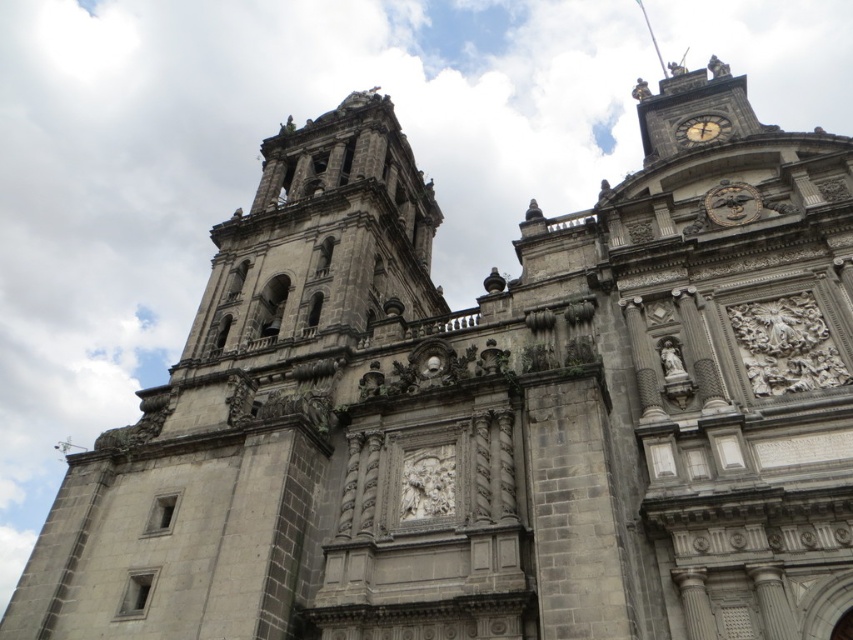
Question: Is gold metallic clock at upper center to the left of golden metallic clock at upper right from the viewer's perspective?

Choices:
 (A) yes
 (B) no

Answer: (A)

Question: Which point is closer to the camera?

Choices:
 (A) golden metallic clock at upper right
 (B) gold metallic clock at upper center

Answer: (B)

Question: Which of the following is the closest to the observer?

Choices:
 (A) (746, 209)
 (B) (677, 129)

Answer: (A)

Question: Which point is closer to the camera?

Choices:
 (A) gold metallic clock at upper center
 (B) golden metallic clock at upper right

Answer: (A)

Question: Can you confirm if gold metallic clock at upper center is smaller than golden metallic clock at upper right?

Choices:
 (A) yes
 (B) no

Answer: (A)

Question: Is gold metallic clock at upper center behind golden metallic clock at upper right?

Choices:
 (A) yes
 (B) no

Answer: (B)